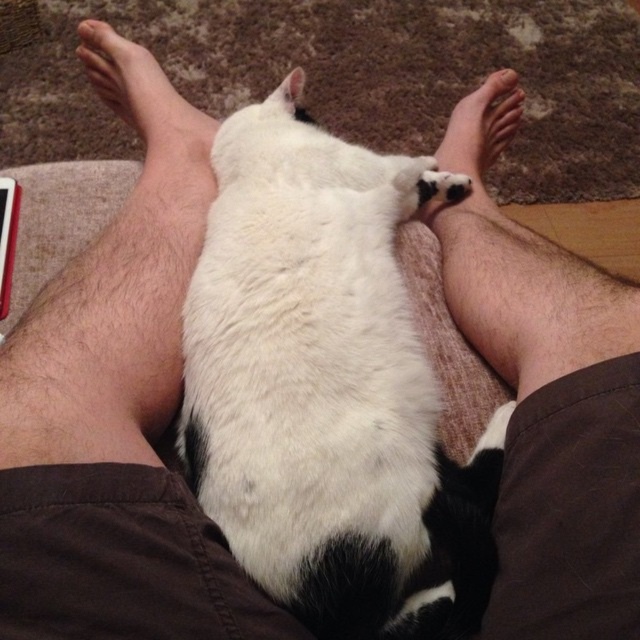
You are a photographer trying to capture the white soft skin at center and the skinny barefoot at upper left in a single shot. Based on their positions, which one will appear larger in the photo?

The white soft skin at center appears larger in the photo because it is taller than the skinny barefoot at upper left.

You are a robot trying to reach a red object located at point (118, 51). There is a cat resting at point (440, 236). Will the cat block your path to the red object?

Point (440, 236) is in front of point (118, 51), so the cat at point (440, 236) will block your path to the red object at point (118, 51).

You are a robotic vacuum cleaner positioned at the entrance of the room. You need to navigate to the red object visible to the left side of the frame without disturbing the white soft fur cat at center. What is the minimum distance you should maintain from the cat to ensure it stays undisturbed?

The white soft fur cat at center is 46.55 centimeters away from the viewer. To avoid disturbing it, the robotic vacuum cleaner should maintain a distance greater than 46.55 centimeters from the cat.